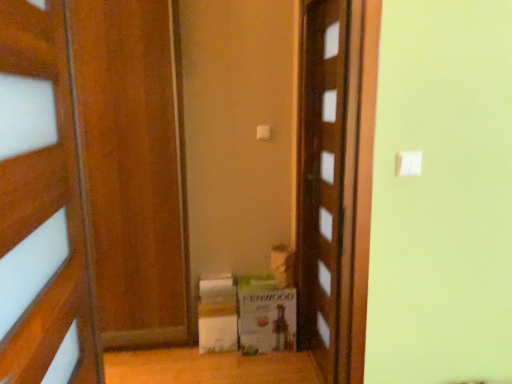
Question: From the image's perspective, is wooden door at center, which ranks as the second door in left-to-right order, located above white cardboard box at lower center, the first cardboard box viewed from the left?

Choices:
 (A) no
 (B) yes

Answer: (B)

Question: Can you confirm if wooden door at center, which ranks as the second door in left-to-right order, is bigger than white cardboard box at lower center, the first cardboard box viewed from the left?

Choices:
 (A) yes
 (B) no

Answer: (A)

Question: Is wooden door at center, which ranks as the second door in left-to-right order, to the left of white cardboard box at lower center, positioned as the 2th cardboard box in right-to-left order, from the viewer's perspective?

Choices:
 (A) yes
 (B) no

Answer: (B)

Question: Can you confirm if wooden door at center, acting as the 2th door starting from the front, is taller than white cardboard box at lower center, positioned as the 2th cardboard box in right-to-left order?

Choices:
 (A) yes
 (B) no

Answer: (A)

Question: From a real-world perspective, does wooden door at center, the first door positioned from the back, stand above white cardboard box at lower center, positioned as the 2th cardboard box in right-to-left order?

Choices:
 (A) no
 (B) yes

Answer: (B)

Question: Is wooden door at center, the first door positioned from the back, facing towards white cardboard box at lower center, positioned as the 2th cardboard box in right-to-left order?

Choices:
 (A) no
 (B) yes

Answer: (B)

Question: Considering the relative sizes of wooden door at center, the first door when ordered from right to left, and wooden door at left, which is the second door in right-to-left order, in the image provided, is wooden door at center, the first door when ordered from right to left, smaller than wooden door at left, which is the second door in right-to-left order,?

Choices:
 (A) yes
 (B) no

Answer: (A)

Question: Does wooden door at center, which ranks as the second door in left-to-right order, have a larger size compared to wooden door at left, placed as the 1th door when sorted from left to right?

Choices:
 (A) no
 (B) yes

Answer: (A)

Question: Is wooden door at center, which ranks as the second door in left-to-right order, oriented away from wooden door at left, which is the second door in right-to-left order?

Choices:
 (A) no
 (B) yes

Answer: (A)

Question: Considering the relative sizes of wooden door at center, the first door when ordered from right to left, and wooden door at left, placed as the 1th door when sorted from left to right, in the image provided, is wooden door at center, the first door when ordered from right to left, wider than wooden door at left, placed as the 1th door when sorted from left to right,?

Choices:
 (A) yes
 (B) no

Answer: (B)

Question: From the image's perspective, is wooden door at center, which ranks as the second door in left-to-right order, under wooden door at left, placed as the 1th door when sorted from left to right?

Choices:
 (A) no
 (B) yes

Answer: (A)

Question: Does wooden door at center, acting as the 2th door starting from the front, come behind wooden door at left, which is the 2th door in back-to-front order?

Choices:
 (A) no
 (B) yes

Answer: (B)

Question: Is wooden door at left, which is the second door in right-to-left order, next to white cardboard box at lower center, positioned as the 2th cardboard box in right-to-left order?

Choices:
 (A) no
 (B) yes

Answer: (A)